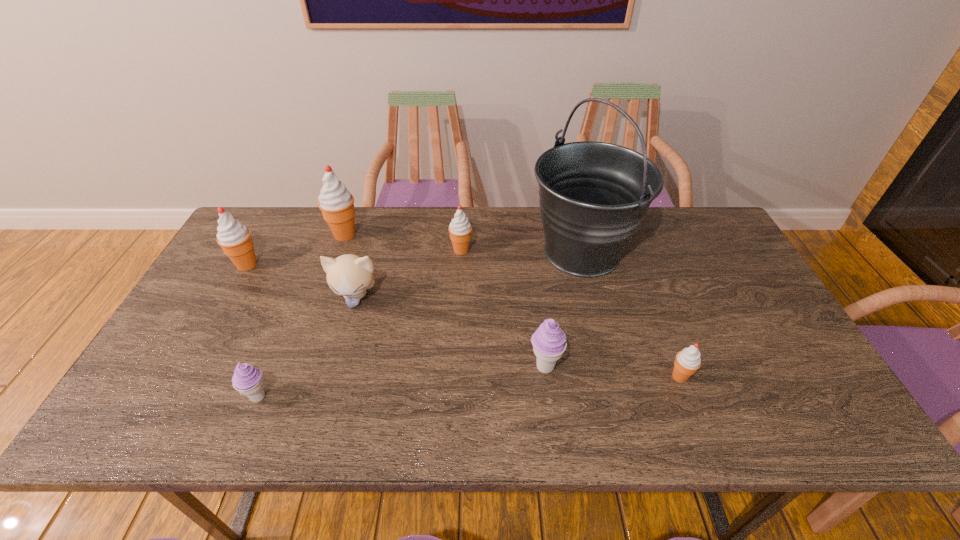
This screenshot has height=540, width=960. I want to click on gray bucket, so click(593, 195).

Identify the location of the tallest object. The height and width of the screenshot is (540, 960). (593, 195).

Locate an element on the screen. the biggest red icecream is located at coordinates (336, 203).

What are the coordinates of `the second tallest object` in the screenshot? It's located at (336, 203).

Find the location of a particular element. the leftmost icecream is located at coordinates (234, 238).

At what (x,y) coordinates should I click in order to perform the action: click on the second tallest icecream. Please return your answer as a coordinate pair (x, y). This screenshot has width=960, height=540. Looking at the image, I should click on (234, 238).

Find the location of `the fourth object from right to left`. the fourth object from right to left is located at coordinates (460, 228).

You are a GUI agent. You are given a task and a screenshot of the screen. Output one action in this format:
    pyautogui.click(x=<x>, y=<y>)
    Task: Click on the second smallest red icecream
    The height and width of the screenshot is (540, 960).
    Given the screenshot: What is the action you would take?
    pyautogui.click(x=460, y=228)

You are a GUI agent. You are given a task and a screenshot of the screen. Output one action in this format:
    pyautogui.click(x=<x>, y=<y>)
    Task: Click on the bigger purple icecream
    This screenshot has width=960, height=540.
    Given the screenshot: What is the action you would take?
    pyautogui.click(x=549, y=342)

The image size is (960, 540). Find the location of `the right purple icecream`. the right purple icecream is located at coordinates (549, 342).